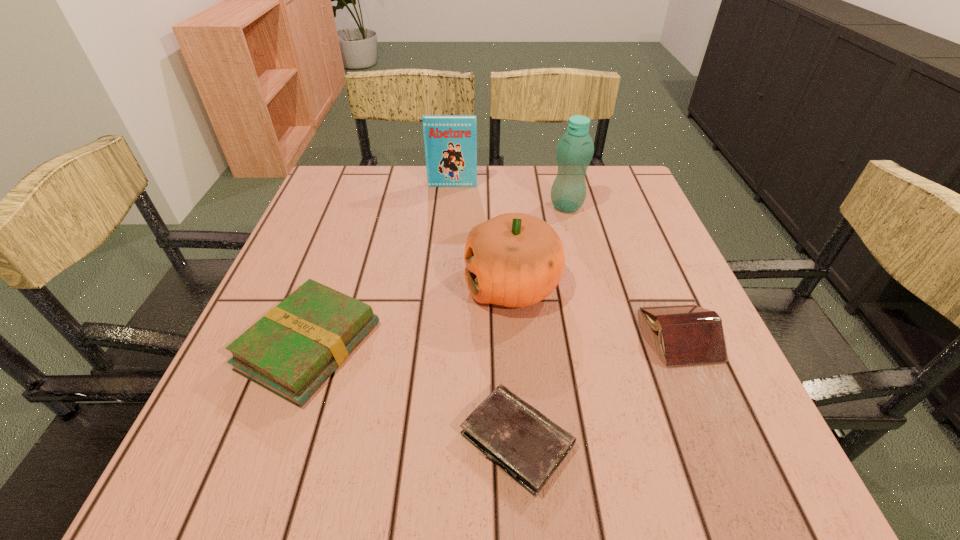
Where is `unoccupied position between the leftmost object and the farthest book`? The image size is (960, 540). unoccupied position between the leftmost object and the farthest book is located at coordinates (381, 266).

You are a GUI agent. You are given a task and a screenshot of the screen. Output one action in this format:
    pyautogui.click(x=<x>, y=<y>)
    Task: Click on the free area in between the leftmost object and the shortest object
    The width and height of the screenshot is (960, 540).
    Given the screenshot: What is the action you would take?
    pyautogui.click(x=414, y=393)

Identify the location of free space that is in between the tallest object and the rightmost book. (624, 271).

Where is `vacant space that's between the tallest object and the rightmost object`? The height and width of the screenshot is (540, 960). vacant space that's between the tallest object and the rightmost object is located at coordinates (624, 271).

Where is `free spot between the shortest object and the tallest object`? free spot between the shortest object and the tallest object is located at coordinates pyautogui.click(x=541, y=323).

Identify the location of free spot between the leftmost book and the farthest object. (381, 266).

The height and width of the screenshot is (540, 960). What are the coordinates of `object that ranks as the second closest to the leftmost object` in the screenshot? It's located at (527, 445).

Locate which object ranks fourth in proximity to the tallest book. Please provide its 2D coordinates. Your answer should be formatted as a tuple, i.e. [(x, y)], where the tuple contains the x and y coordinates of a point satisfying the conditions above.

[(688, 334)]

This screenshot has width=960, height=540. I want to click on book that is the closest to the leftmost object, so click(x=450, y=141).

Identify which book is located as the second nearest to the shortest object. Please provide its 2D coordinates. Your answer should be formatted as a tuple, i.e. [(x, y)], where the tuple contains the x and y coordinates of a point satisfying the conditions above.

[(688, 334)]